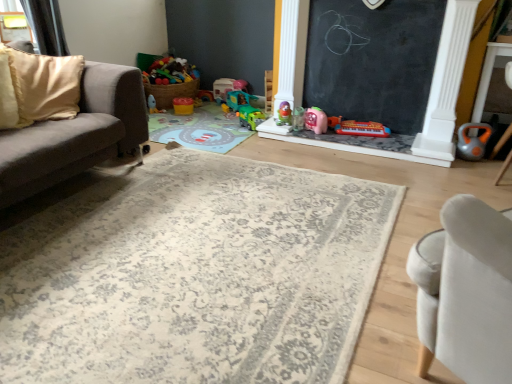
Question: From the image's perspective, is yellow plastic cup at center, placed as the second toy when sorted from left to right, located beneath beige fabric couch at left?

Choices:
 (A) yes
 (B) no

Answer: (B)

Question: Can you confirm if yellow plastic cup at center, placed as the second toy when sorted from left to right, is positioned to the right of beige fabric couch at left?

Choices:
 (A) no
 (B) yes

Answer: (B)

Question: Can beige fabric couch at left be found inside yellow plastic cup at center, placed as the second toy when sorted from left to right?

Choices:
 (A) yes
 (B) no

Answer: (B)

Question: Is yellow plastic cup at center, positioned as the ninth toy in right-to-left order, positioned with its back to beige fabric couch at left?

Choices:
 (A) yes
 (B) no

Answer: (B)

Question: Considering the relative sizes of yellow plastic cup at center, positioned as the ninth toy in right-to-left order, and beige fabric couch at left in the image provided, is yellow plastic cup at center, positioned as the ninth toy in right-to-left order, thinner than beige fabric couch at left?

Choices:
 (A) yes
 (B) no

Answer: (A)

Question: From a real-world perspective, relative to beige fabric couch at left, is transparent plastic window at upper left vertically above or below?

Choices:
 (A) above
 (B) below

Answer: (A)

Question: Is point (19, 36) positioned closer to the camera than point (120, 102)?

Choices:
 (A) closer
 (B) farther

Answer: (B)

Question: Based on their sizes in the image, would you say transparent plastic window at upper left is bigger or smaller than beige fabric couch at left?

Choices:
 (A) big
 (B) small

Answer: (B)

Question: Is transparent plastic window at upper left in front of or behind beige fabric couch at left in the image?

Choices:
 (A) behind
 (B) front

Answer: (A)

Question: Is beige fabric pillow at left inside or outside of green plastic toy car at center, which ranks as the fifth toy in left-to-right order?

Choices:
 (A) inside
 (B) outside

Answer: (B)

Question: Considering the positions of beige fabric pillow at left and green plastic toy car at center, which is the 6th toy from right to left, in the image, is beige fabric pillow at left bigger or smaller than green plastic toy car at center, which is the 6th toy from right to left,?

Choices:
 (A) big
 (B) small

Answer: (A)

Question: In the image, is beige fabric pillow at left positioned in front of or behind green plastic toy car at center, which ranks as the fifth toy in left-to-right order?

Choices:
 (A) behind
 (B) front

Answer: (B)

Question: Is point (31, 117) closer or farther from the camera than point (247, 112)?

Choices:
 (A) farther
 (B) closer

Answer: (B)

Question: Looking at their shapes, would you say orange rubber kettlebell at right, the tenth toy from the left, is wider or thinner than transparent plastic window at upper left?

Choices:
 (A) wide
 (B) thin

Answer: (A)

Question: From a real-world perspective, is orange rubber kettlebell at right, the tenth toy from the left, above or below transparent plastic window at upper left?

Choices:
 (A) above
 (B) below

Answer: (B)